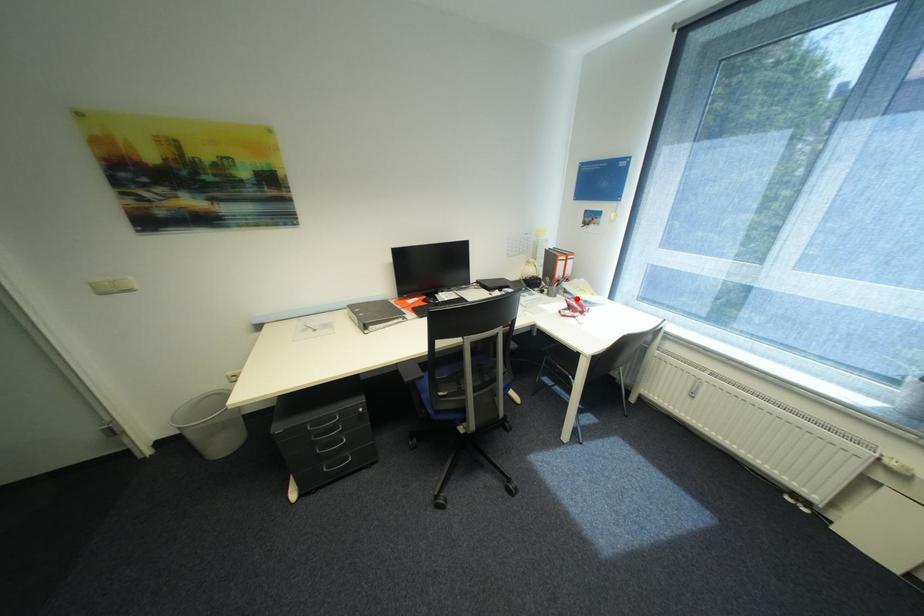
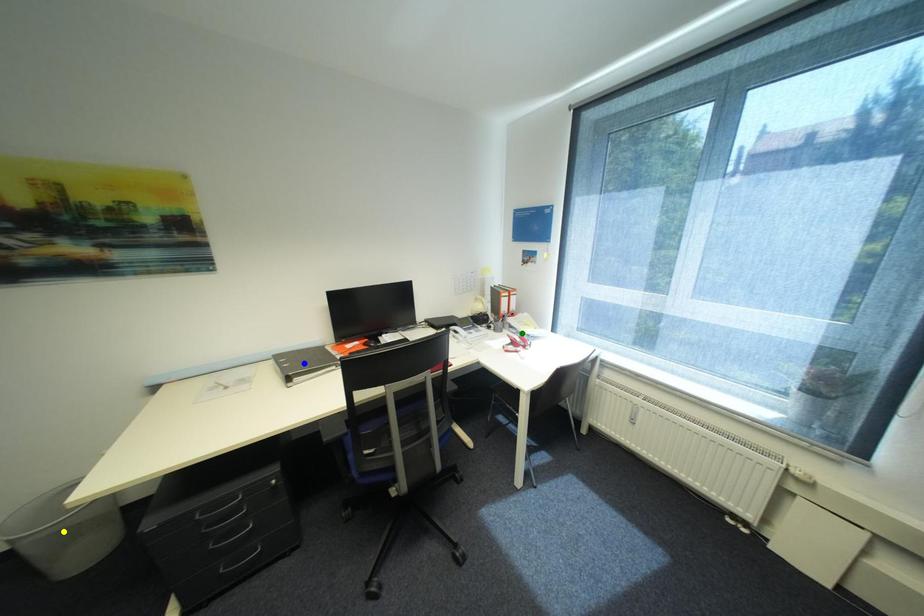
Question: I am providing you with two images of the same scene from different viewpoints. A red point is marked on the first image. You are given multiple points on the second image. Which point in image 2 represents the same 3d spot as the red point in image 1?

Choices:
 (A) blue point
 (B) yellow point
 (C) green point

Answer: (C)